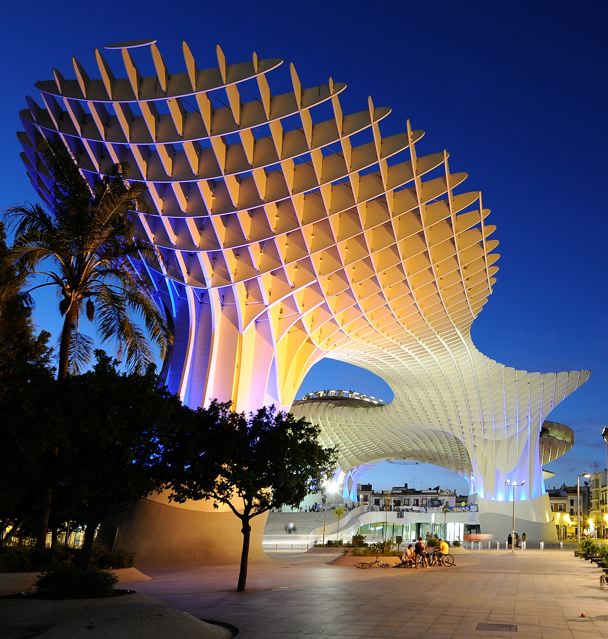
Locate an element on the screen. Image resolution: width=608 pixels, height=639 pixels. pillars is located at coordinates (541, 544), (560, 544), (505, 544), (522, 544), (495, 544), (489, 544), (478, 544), (470, 544).